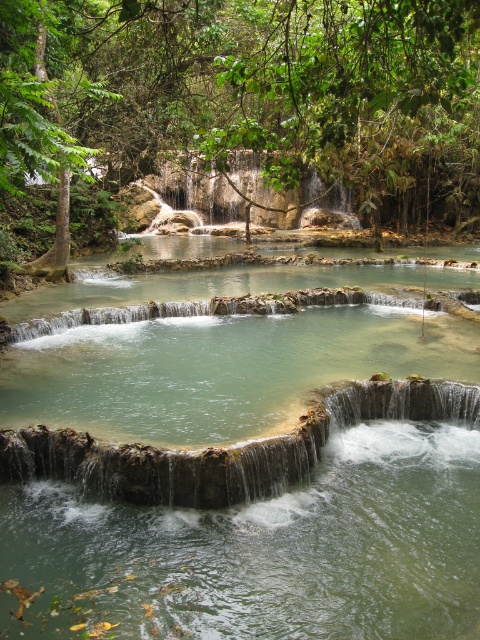
Question: Which of the following is the farthest from the observer?

Choices:
 (A) (58, 3)
 (B) (360, 449)

Answer: (A)

Question: From the image, what is the correct spatial relationship of green stone waterfall at center in relation to green leafy tree at upper center?

Choices:
 (A) right
 (B) left

Answer: (A)

Question: In this image, where is green stone waterfall at center located relative to green leafy tree at upper center?

Choices:
 (A) right
 (B) left

Answer: (A)

Question: Which point is closer to the camera?

Choices:
 (A) pos(463,214)
 (B) pos(175,396)

Answer: (B)

Question: Is green stone waterfall at center in front of green leafy tree at upper center?

Choices:
 (A) yes
 (B) no

Answer: (B)